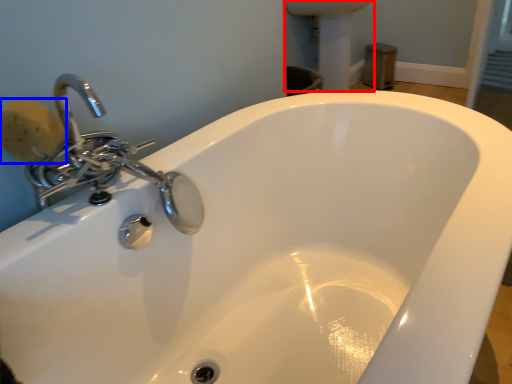
Question: Which point is closer to the camera, porcelain (highlighted by a red box) or soap (highlighted by a blue box)?

Choices:
 (A) porcelain
 (B) soap

Answer: (B)